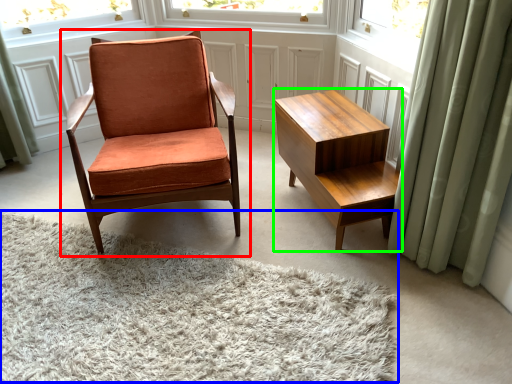
Question: Considering the real-world distances, which object is closest to chair (highlighted by a red box)? plain (highlighted by a blue box) or table (highlighted by a green box).

Choices:
 (A) plain
 (B) table

Answer: (B)